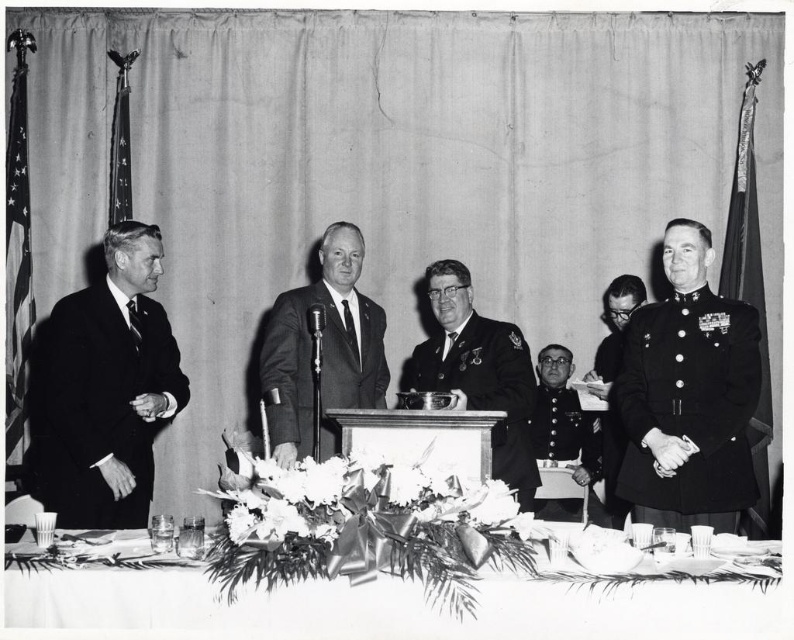
Can you confirm if uniformed officer at center is wider than uniform military at right?

Indeed, uniformed officer at center has a greater width compared to uniform military at right.

Does uniformed officer at center appear over uniform military at right?

Indeed, uniformed officer at center is positioned over uniform military at right.

You are a GUI agent. You are given a task and a screenshot of the screen. Output one action in this format:
    pyautogui.click(x=<x>, y=<y>)
    Task: Click on the uniformed officer at center
    The height and width of the screenshot is (640, 794).
    Given the screenshot: What is the action you would take?
    pyautogui.click(x=478, y=372)

Which is above, white paper napkin at lower center or uniform at right?

Positioned higher is uniform at right.

Who is positioned more to the right, white paper napkin at lower center or uniform at right?

Positioned to the right is uniform at right.

Image resolution: width=794 pixels, height=640 pixels. Describe the element at coordinates (388, 609) in the screenshot. I see `white paper napkin at lower center` at that location.

At what (x,y) coordinates should I click in order to perform the action: click on white paper napkin at lower center. Please return your answer as a coordinate pair (x, y). The width and height of the screenshot is (794, 640). Looking at the image, I should click on (388, 609).

Who is more forward, [303,451] or [598,467]?

Point [303,451] is in front.

Can you confirm if smooth black suit at center is positioned below uniform at center?

Incorrect, smooth black suit at center is not positioned below uniform at center.

Find the location of a particular element. smooth black suit at center is located at coordinates (320, 360).